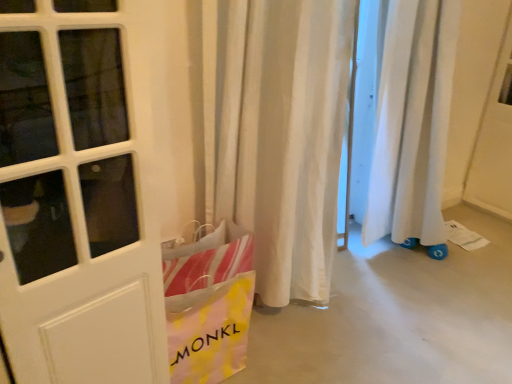
From the picture: In order to face yellow and pink plastic bag at lower left, should I rotate leftwards or rightwards?

It's best to rotate left around 7.183 degrees.

Where is `yellow and pink plastic bag at lower left`? yellow and pink plastic bag at lower left is located at coordinates (209, 308).

What do you see at coordinates (209, 308) in the screenshot?
I see `yellow and pink plastic bag at lower left` at bounding box center [209, 308].

Based on the photo, what is the approximate width of yellow and pink plastic bag at lower left?

7.08 inches.

Image resolution: width=512 pixels, height=384 pixels. Describe the element at coordinates (281, 135) in the screenshot. I see `white fabric curtain at center` at that location.

At what (x,y) coordinates should I click in order to perform the action: click on white fabric curtain at center. Please return your answer as a coordinate pair (x, y). The image size is (512, 384). Looking at the image, I should click on (281, 135).

Measure the distance between point (x=283, y=102) and camera.

Point (x=283, y=102) is 4.84 feet away from camera.

Where is `yellow and pink plastic bag at lower left`? The image size is (512, 384). yellow and pink plastic bag at lower left is located at coordinates (209, 308).

Consider the image. Which object is positioned more to the right, yellow and pink plastic bag at lower left or white fabric curtain at center?

Positioned to the right is white fabric curtain at center.

Who is more distant, yellow and pink plastic bag at lower left or white fabric curtain at center?

yellow and pink plastic bag at lower left is more distant.

Is point (195, 307) positioned in front of point (251, 105)?

Yes, point (195, 307) is closer to viewer.

From the image's perspective, is yellow and pink plastic bag at lower left on top of white fabric curtain at center?

No, from the image's perspective, yellow and pink plastic bag at lower left is not above white fabric curtain at center.

From a real-world perspective, is yellow and pink plastic bag at lower left on top of white fabric curtain at center?

Incorrect, from a real-world perspective, yellow and pink plastic bag at lower left is lower than white fabric curtain at center.

Can you confirm if yellow and pink plastic bag at lower left is thinner than white fabric curtain at center?

Yes.

From their relative heights in the image, would you say yellow and pink plastic bag at lower left is taller or shorter than white fabric curtain at center?

In the image, yellow and pink plastic bag at lower left appears to be shorter than white fabric curtain at center.

Considering the sizes of objects yellow and pink plastic bag at lower left and white fabric curtain at center in the image provided, who is bigger, yellow and pink plastic bag at lower left or white fabric curtain at center?

With larger size is white fabric curtain at center.

Could white fabric curtain at center be considered to be inside yellow and pink plastic bag at lower left?

No, white fabric curtain at center is located outside of yellow and pink plastic bag at lower left.

Are yellow and pink plastic bag at lower left and white fabric curtain at center beside each other?

They are not placed beside each other.

Could you tell me if yellow and pink plastic bag at lower left is turned towards white fabric curtain at center?

No, yellow and pink plastic bag at lower left is not facing towards white fabric curtain at center.

What's the angular difference between yellow and pink plastic bag at lower left and white fabric curtain at center's facing directions?

1.24 degrees separate the facing orientations of yellow and pink plastic bag at lower left and white fabric curtain at center.

Identify the location of grocery bag below the white fabric curtain at center (from a real-world perspective). (209, 308).

Between white fabric curtain at center and yellow and pink plastic bag at lower left, which one appears on the left side from the viewer's perspective?

yellow and pink plastic bag at lower left is more to the left.

Between white fabric curtain at center and yellow and pink plastic bag at lower left, which one is positioned in front?

white fabric curtain at center is in front.

Considering the positions of point (228, 106) and point (226, 309), is point (228, 106) closer or farther from the camera than point (226, 309)?

Point (228, 106) appears to be farther away from the viewer than point (226, 309).

Looking at this image, from the image's perspective, who appears lower, white fabric curtain at center or yellow and pink plastic bag at lower left?

yellow and pink plastic bag at lower left.

From a real-world perspective, who is located lower, white fabric curtain at center or yellow and pink plastic bag at lower left?

yellow and pink plastic bag at lower left.

Which of these two, white fabric curtain at center or yellow and pink plastic bag at lower left, is thinner?

yellow and pink plastic bag at lower left.

In terms of height, does white fabric curtain at center look taller or shorter compared to yellow and pink plastic bag at lower left?

Clearly, white fabric curtain at center is taller compared to yellow and pink plastic bag at lower left.

Considering the relative sizes of white fabric curtain at center and yellow and pink plastic bag at lower left in the image provided, is white fabric curtain at center bigger than yellow and pink plastic bag at lower left?

Yes.

Is white fabric curtain at center not within yellow and pink plastic bag at lower left?

Indeed, white fabric curtain at center is completely outside yellow and pink plastic bag at lower left.

Based on the photo, is white fabric curtain at center positioned far away from yellow and pink plastic bag at lower left?

Answer: white fabric curtain at center is actually quite close to yellow and pink plastic bag at lower left.

Is white fabric curtain at center looking in the opposite direction of yellow and pink plastic bag at lower left?

No, yellow and pink plastic bag at lower left is not at the back of white fabric curtain at center.

In the scene shown: How many degrees apart are the facing directions of white fabric curtain at center and yellow and pink plastic bag at lower left?

The angular difference between white fabric curtain at center and yellow and pink plastic bag at lower left is 1.24 degrees.

Measure the distance between white fabric curtain at center and yellow and pink plastic bag at lower left.

white fabric curtain at center is 15.42 inches away from yellow and pink plastic bag at lower left.

There is a yellow and pink plastic bag at lower left. Identify the location of curtain above it (from a real-world perspective). (281, 135).

You are a GUI agent. You are given a task and a screenshot of the screen. Output one action in this format:
    pyautogui.click(x=<x>, y=<y>)
    Task: Click on the grocery bag located behind the white fabric curtain at center
    The image size is (512, 384).
    Given the screenshot: What is the action you would take?
    pyautogui.click(x=209, y=308)

Image resolution: width=512 pixels, height=384 pixels. Find the location of `curtain in front of the yellow and pink plastic bag at lower left`. curtain in front of the yellow and pink plastic bag at lower left is located at coordinates (281, 135).